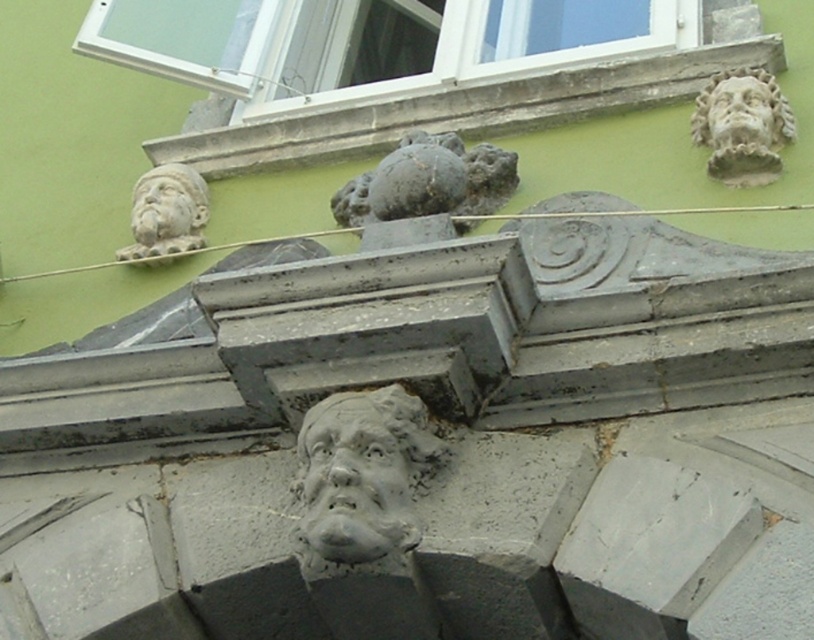
Question: Which point appears closest to the camera in this image?

Choices:
 (A) (703, 120)
 (B) (152, 228)

Answer: (A)

Question: Is gray stone face at center to the left of matte gray stone face at upper left from the viewer's perspective?

Choices:
 (A) no
 (B) yes

Answer: (A)

Question: Estimate the real-world distances between objects in this image. Which object is farther from the gray stone head at upper right?

Choices:
 (A) gray stone face at upper right
 (B) gray stone face at center

Answer: (B)

Question: Which point appears closest to the camera in this image?

Choices:
 (A) (370, 515)
 (B) (195, 202)
 (C) (766, 145)

Answer: (A)

Question: Does gray stone face at center appear on the right side of gray stone head at upper left?

Choices:
 (A) yes
 (B) no

Answer: (A)

Question: Is the position of gray stone head at upper right less distant than that of matte gray stone face at upper left?

Choices:
 (A) yes
 (B) no

Answer: (A)